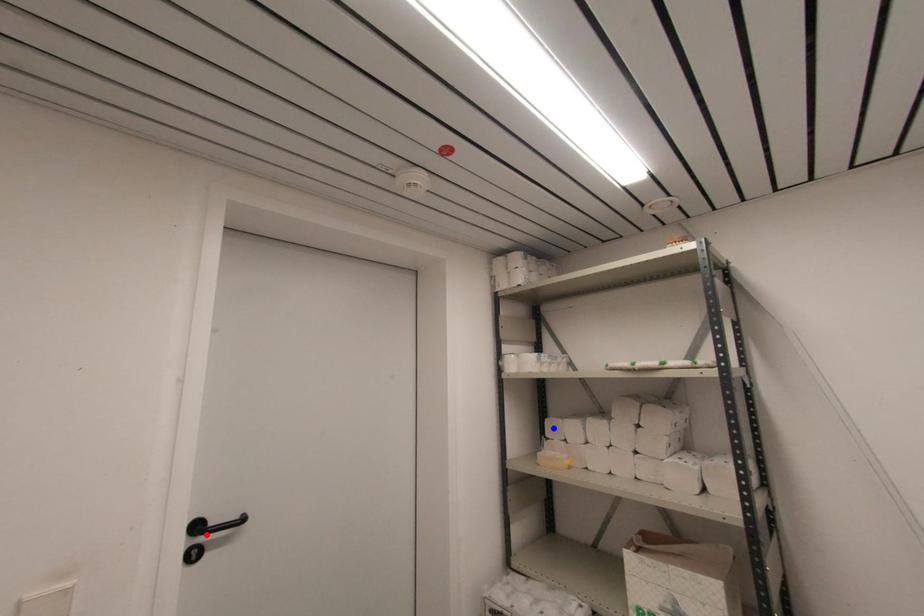
Question: Which of the two points in the image is closer to the camera?

Choices:
 (A) Blue point is closer.
 (B) Red point is closer.

Answer: (B)